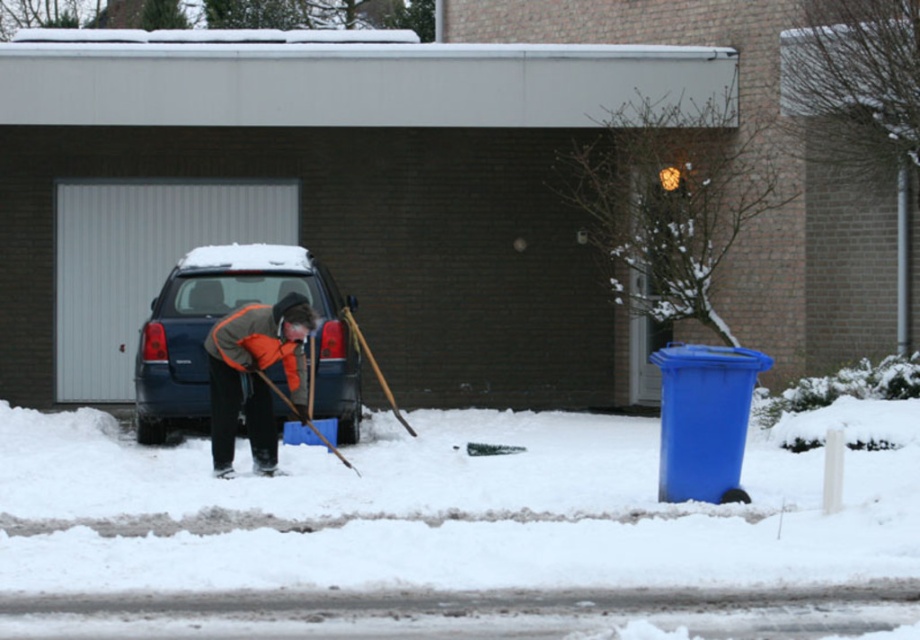
You are a delivery person trying to reach the garage to drop off a package. You see the dark gray brick garage at center and the wooden shovel at lower center. Which object is closer to you?

The wooden shovel at lower center is closer to you because it is positioned under the dark gray brick garage at center.

You are standing at the point marked by the coordinates point (x=317, y=195). Based on the scene description, what object are you directly facing?

The point (x=317, y=195) indicates dark gray brick garage at center, so you are directly facing the dark gray brick garage at center.

You are standing at the position of the person shoveling snow and want to place a marker at both point (560, 294) and point (297, 412). Which point is closer to you?

Point (560, 294) is closer to you because it is further to the viewer than point (297, 412).